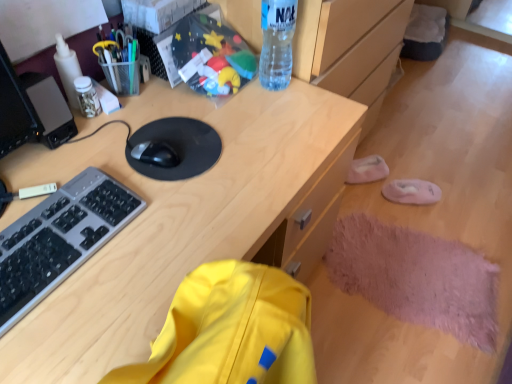
This screenshot has width=512, height=384. Identify the location of unoccupied region to the right of black matte mousepad at center. (259, 148).